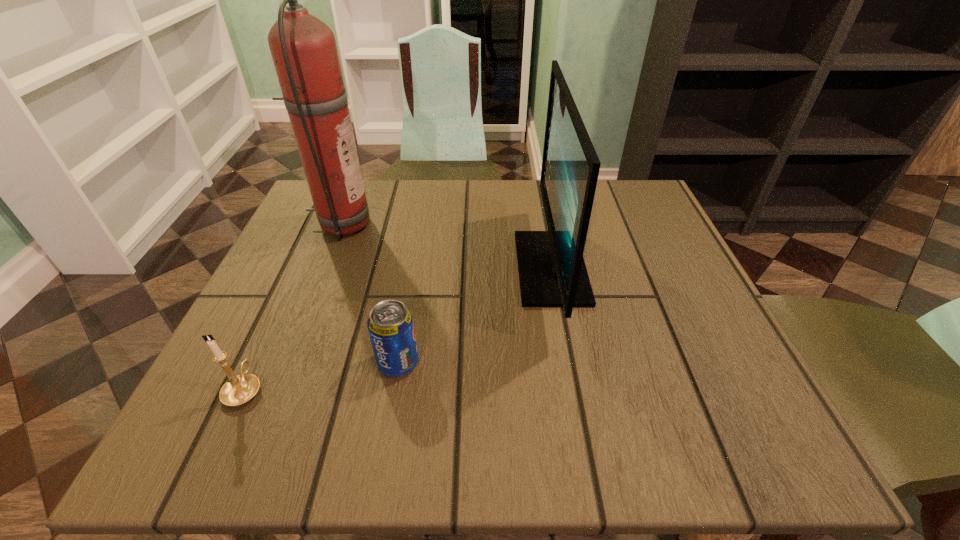
Find the location of a particular element. Image resolution: width=960 pixels, height=540 pixels. the tallest object is located at coordinates (303, 48).

This screenshot has height=540, width=960. Find the location of `monitor`. monitor is located at coordinates (552, 273).

Find the location of a particular element. The height and width of the screenshot is (540, 960). the rightmost object is located at coordinates (552, 273).

This screenshot has width=960, height=540. In order to click on candle holder in this screenshot , I will do `click(239, 389)`.

Where is `the third object from left to right`? The image size is (960, 540). the third object from left to right is located at coordinates (390, 325).

Where is `blank space located on the side of the tallest object with the label and nozzle`? This screenshot has height=540, width=960. blank space located on the side of the tallest object with the label and nozzle is located at coordinates (460, 225).

Image resolution: width=960 pixels, height=540 pixels. In order to click on vacant region located 0.370m on the screen side of the rightmost object in this screenshot , I will do `click(333, 267)`.

I want to click on vacant space located on the screen side of the rightmost object, so click(x=433, y=267).

Find the location of `free space located on the screen side of the rightmost object`. free space located on the screen side of the rightmost object is located at coordinates (458, 267).

Identify the location of free space located on the handle side of the candle holder. (300, 270).